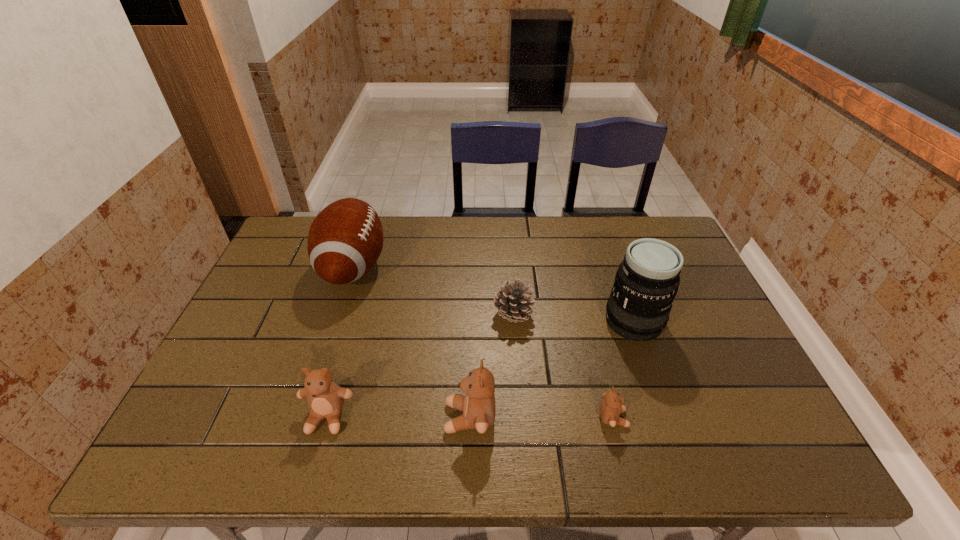
Find the location of a particular element. The height and width of the screenshot is (540, 960). vacant space at the near edge of the desktop is located at coordinates (582, 419).

Find the location of `blank space at the left edge of the desktop`. blank space at the left edge of the desktop is located at coordinates (311, 282).

Find the location of `free space at the right edge`. free space at the right edge is located at coordinates (686, 329).

Where is `free point between the second teddy bear from left to right and the shortest object`? free point between the second teddy bear from left to right and the shortest object is located at coordinates (541, 418).

Identify the location of vacant area that lies between the second shortest object and the fifth object from left to right. (563, 366).

Identify the location of free area in between the shortest teddy bear and the football. (483, 342).

You are a GUI agent. You are given a task and a screenshot of the screen. Output one action in this format:
    pyautogui.click(x=<x>, y=<y>)
    Task: Click on the free spot between the third object from left to right and the second shortest object
    
    Given the screenshot: What is the action you would take?
    pyautogui.click(x=492, y=366)

This screenshot has height=540, width=960. In order to click on vacant region between the leftmost teddy bear and the second teddy bear from right to left in this screenshot , I will do `click(398, 417)`.

This screenshot has width=960, height=540. In order to click on free point between the fifth tallest object and the telephoto lens in this screenshot , I will do `click(573, 318)`.

Where is `empty location between the fourth object from right to left and the football`? empty location between the fourth object from right to left and the football is located at coordinates (412, 342).